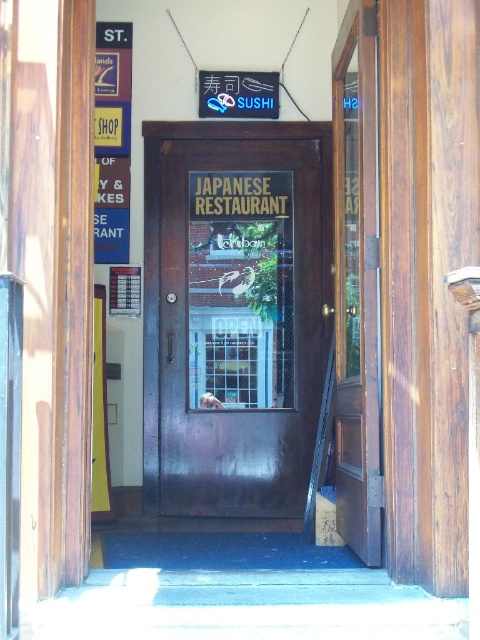
Does mahogany wood door at right lie in front of metallic signboard at left?

Yes, mahogany wood door at right is closer to the viewer.

Does mahogany wood door at right have a greater height compared to metallic signboard at left?

Yes, mahogany wood door at right is taller than metallic signboard at left.

Who is more forward, (347, 532) or (99, 104)?

Point (347, 532)

The width and height of the screenshot is (480, 640). In order to click on mahogany wood door at right in this screenshot , I will do `click(357, 282)`.

Which is above, dark wood door at center or mahogany wood door at right?

mahogany wood door at right

Is point (316, 161) farther from camera compared to point (334, 202)?

Yes, it is behind point (334, 202).

Describe the element at coordinates (233, 314) in the screenshot. The image size is (480, 640). I see `dark wood door at center` at that location.

Find the location of a particular element. dark wood door at center is located at coordinates (233, 314).

Looking at this image, does dark wood door at center have a greater width compared to metallic signboard at left?

Yes.

Looking at this image, between dark wood door at center and metallic signboard at left, which one appears on the left side from the viewer's perspective?

metallic signboard at left

The width and height of the screenshot is (480, 640). In order to click on dark wood door at center in this screenshot , I will do `click(233, 314)`.